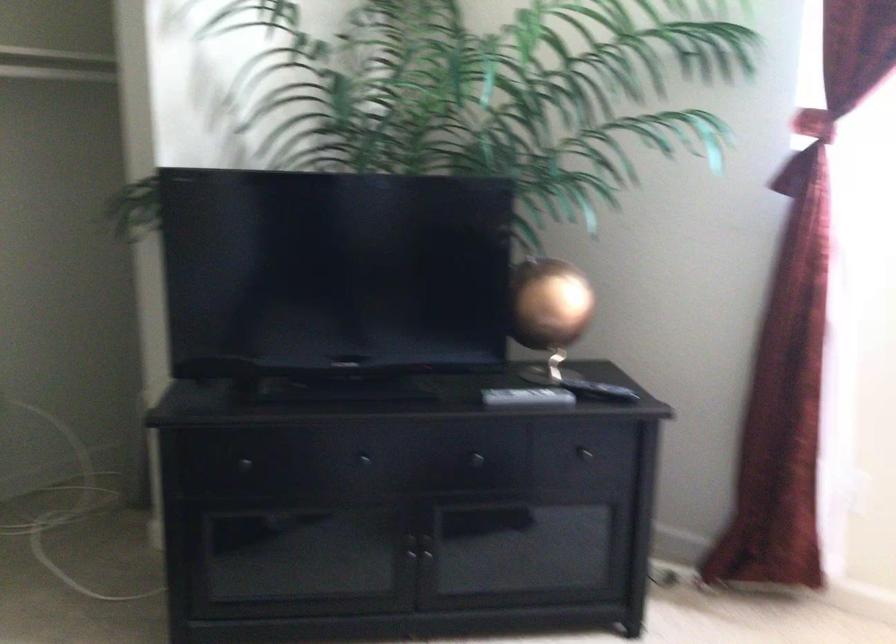
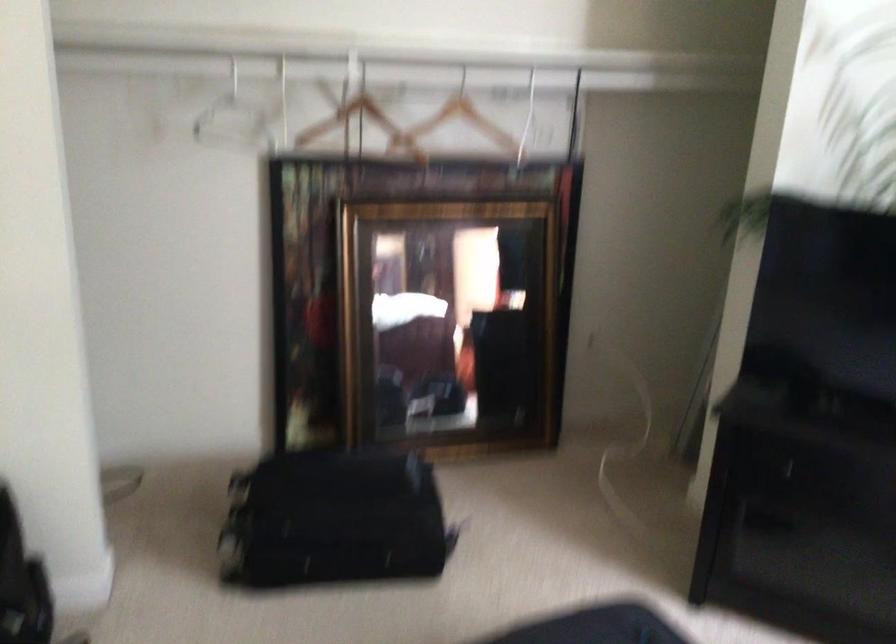
Question: The camera is either moving clockwise (left) or counter-clockwise (right) around the object. The first image is from the beginning of the video and the second image is from the end. Is the camera moving left or right when shooting the video?

Choices:
 (A) Left
 (B) Right

Answer: (B)